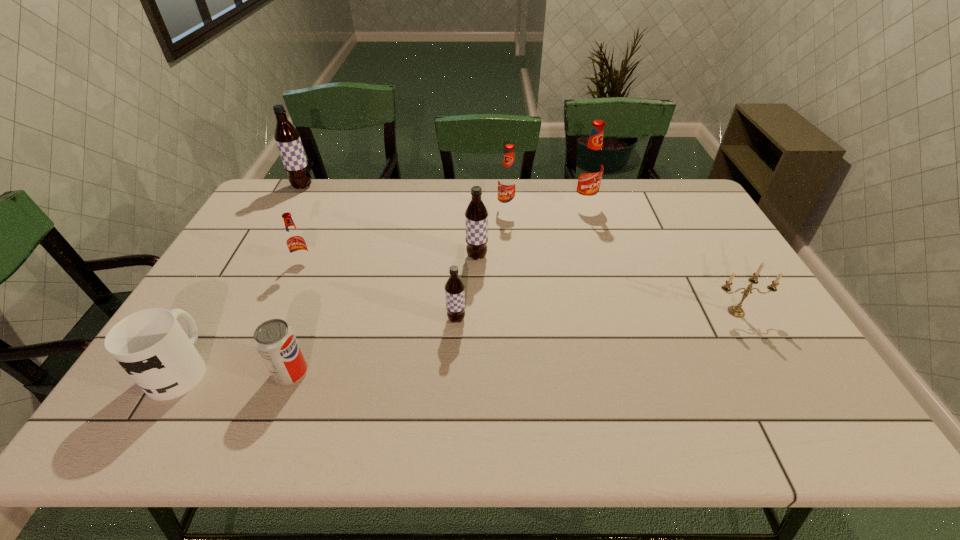
What are the coordinates of `vacant space situated on the back of the nearest brown root beer` in the screenshot? It's located at (461, 227).

I want to click on free location located 0.080m on the left of the candle, so click(680, 312).

Image resolution: width=960 pixels, height=540 pixels. In order to click on vacant area situated 0.360m on the handle side of the mug in this screenshot , I will do `click(252, 249)`.

Where is `free space located on the handle side of the mug`? free space located on the handle side of the mug is located at coordinates (222, 300).

This screenshot has height=540, width=960. What are the coordinates of `vacant space located 0.390m on the handle side of the mug` in the screenshot? It's located at (255, 242).

You are a GUI agent. You are given a task and a screenshot of the screen. Output one action in this format:
    pyautogui.click(x=<x>, y=<y>)
    Task: Click on the vacant space situated on the right of the sixth object from right to left
    This screenshot has height=540, width=960.
    Given the screenshot: What is the action you would take?
    pyautogui.click(x=363, y=373)

Locate an element on the screen. The height and width of the screenshot is (540, 960). root beer that is at the left edge is located at coordinates (288, 141).

This screenshot has height=540, width=960. I want to click on mug positioned at the left edge, so click(150, 345).

Where is `object positioned at the right edge`? object positioned at the right edge is located at coordinates (735, 310).

Locate an element on the screen. The image size is (960, 540). object located at the far left corner is located at coordinates (288, 141).